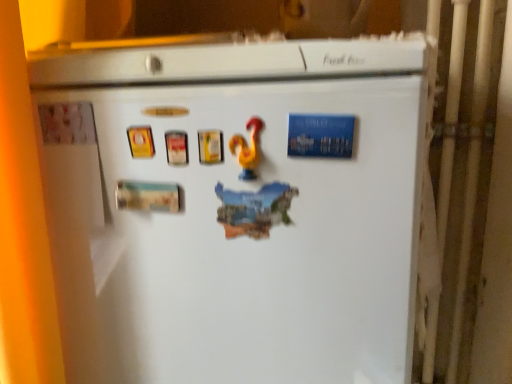
Question: From a real-world perspective, relative to white matte refrigerator at center, is yellow rubber duck at center vertically above or below?

Choices:
 (A) above
 (B) below

Answer: (A)

Question: Is yellow rubber duck at center bigger or smaller than white matte refrigerator at center?

Choices:
 (A) big
 (B) small

Answer: (B)

Question: From their relative heights in the image, would you say yellow rubber duck at center is taller or shorter than white matte refrigerator at center?

Choices:
 (A) tall
 (B) short

Answer: (B)

Question: Relative to yellow rubber duck at center, is white matte refrigerator at center in front or behind?

Choices:
 (A) behind
 (B) front

Answer: (B)

Question: From the image's perspective, relative to yellow rubber duck at center, is white matte refrigerator at center above or below?

Choices:
 (A) above
 (B) below

Answer: (B)

Question: Visually, is white matte refrigerator at center positioned to the left or to the right of yellow rubber duck at center?

Choices:
 (A) right
 (B) left

Answer: (B)

Question: Considering the positions of white matte refrigerator at center and yellow rubber duck at center in the image, is white matte refrigerator at center bigger or smaller than yellow rubber duck at center?

Choices:
 (A) big
 (B) small

Answer: (A)